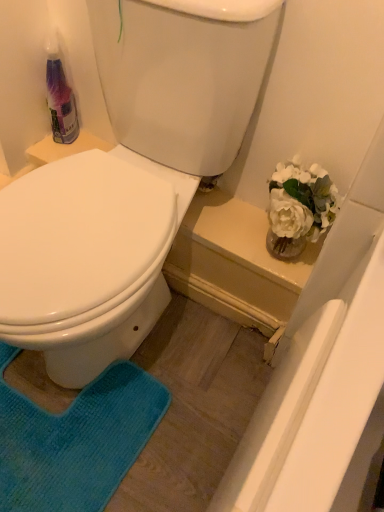
At what (x,y) coordinates should I click in order to perform the action: click on free space between white glossy toilet at center and blue textured rug at lower left. Please return your answer as a coordinate pair (x, y). This screenshot has height=512, width=384. Looking at the image, I should click on (177, 353).